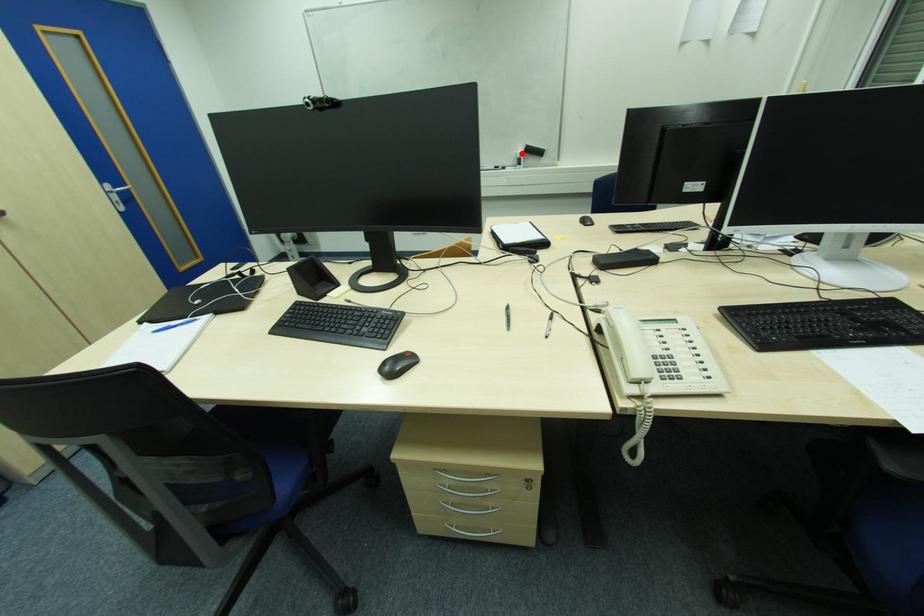
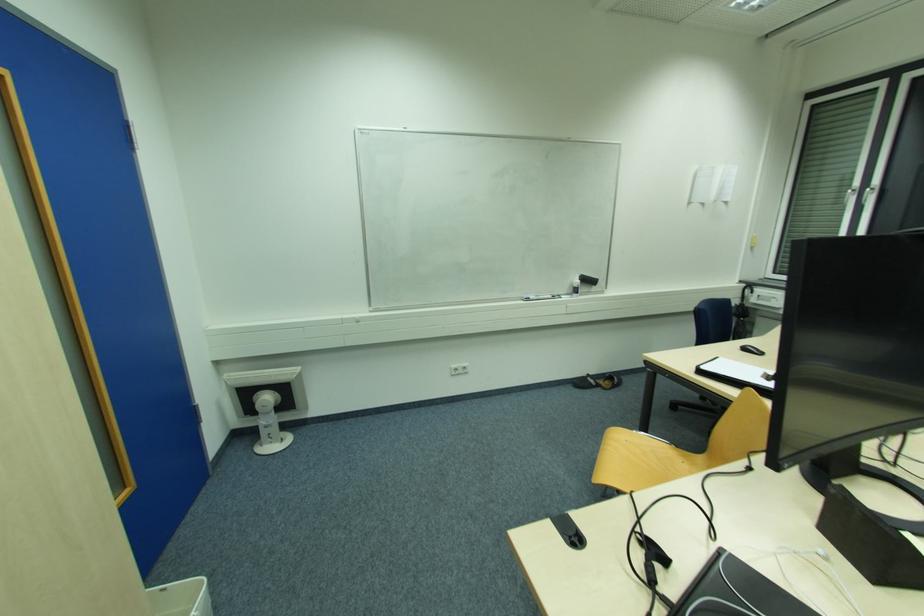
In the second image, find the point that corresponds to the highlighted location in the first image.

(578, 282)